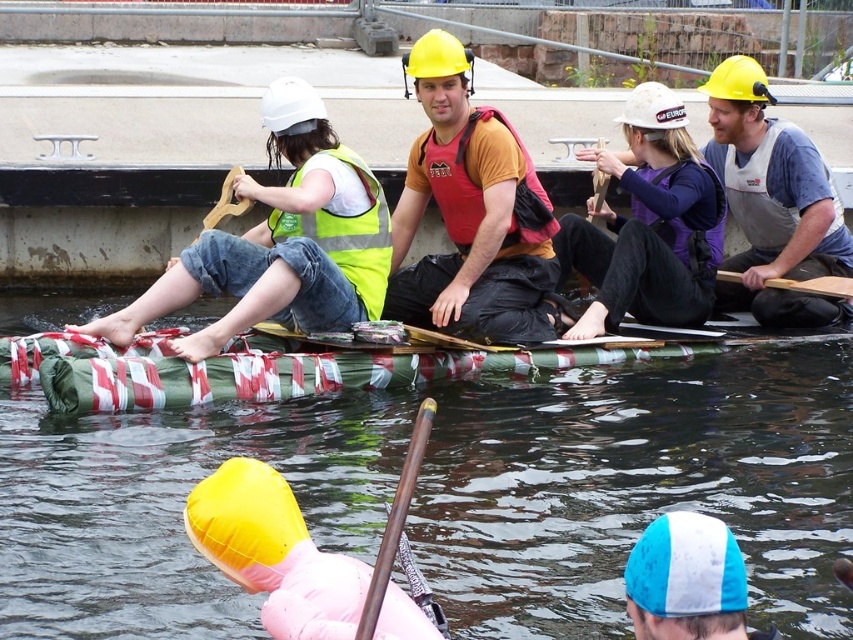
Question: Is matte orange t-shirt at center thinner than matte red life vest at center?

Choices:
 (A) no
 (B) yes

Answer: (A)

Question: Is purple fleece jacket at upper center smaller than high visibility fabric safety vest at left?

Choices:
 (A) yes
 (B) no

Answer: (B)

Question: Which of the following is the farthest from the observer?

Choices:
 (A) high visibility yellow vest at left
 (B) wooden paddle at center
 (C) matte gray vest at center
 (D) camouflage fabric raft at center

Answer: (C)

Question: Which object is closer to the camera taking this photo?

Choices:
 (A) purple fleece jacket at upper center
 (B) matte orange t-shirt at center
 (C) wooden paddle at center

Answer: (B)

Question: Is matte orange t-shirt at center bigger than camouflage fabric raft at center?

Choices:
 (A) yes
 (B) no

Answer: (B)

Question: Which point is closer to the camera taking this photo?

Choices:
 (A) (347, 150)
 (B) (161, 330)
 (C) (553, 221)

Answer: (B)